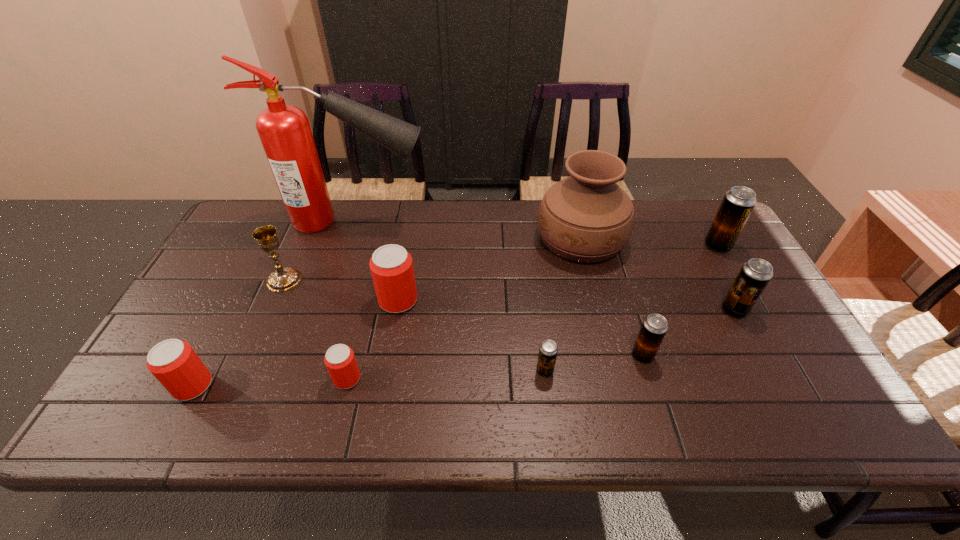
You are a GUI agent. You are given a task and a screenshot of the screen. Output one action in this format:
    pyautogui.click(x=<x>, y=<y>)
    Task: Click on the object that is at the near edge
    The image size is (960, 540).
    Given the screenshot: What is the action you would take?
    pyautogui.click(x=173, y=362)

Locate an element on the screen. fire extinguisher that is at the left edge is located at coordinates (284, 130).

The height and width of the screenshot is (540, 960). I want to click on beer can located at the left edge, so click(x=173, y=362).

Image resolution: width=960 pixels, height=540 pixels. I want to click on object that is at the far left corner, so click(284, 130).

The image size is (960, 540). What are the coordinates of `object that is positioned at the near left corner` in the screenshot? It's located at (173, 362).

Image resolution: width=960 pixels, height=540 pixels. Find the location of `object that is positioned at the far right corner`. object that is positioned at the far right corner is located at coordinates pyautogui.click(x=738, y=203).

Where is `vacant position at the far edge of the desktop`? vacant position at the far edge of the desktop is located at coordinates (634, 240).

Identify the location of free space at the near edge. The height and width of the screenshot is (540, 960). (487, 399).

The image size is (960, 540). I want to click on vacant space at the right edge, so [794, 395].

The height and width of the screenshot is (540, 960). In order to click on vacant space at the far right corner of the desktop in this screenshot , I will do `click(668, 205)`.